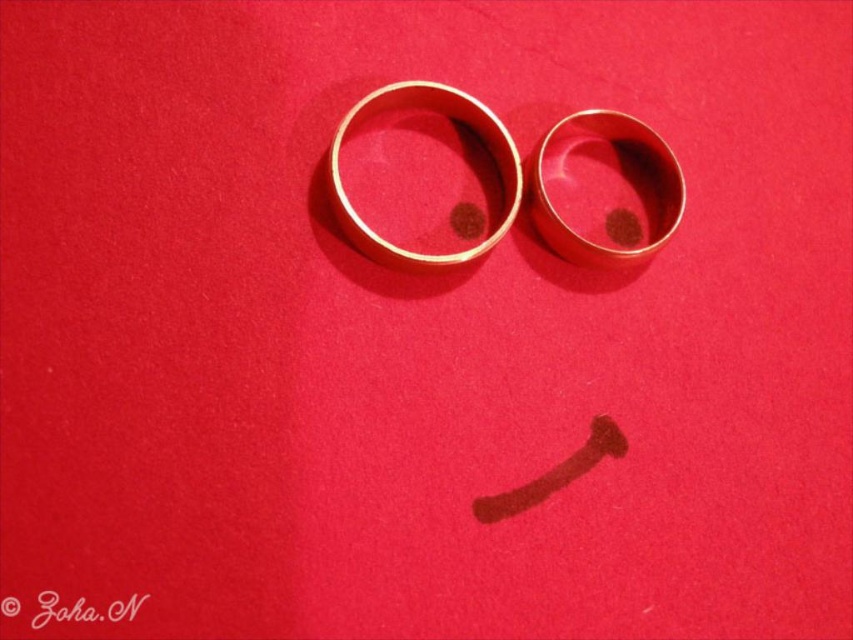
Question: Is gold polished ring at upper right to the left of gold polished ring at center from the viewer's perspective?

Choices:
 (A) no
 (B) yes

Answer: (A)

Question: Which point appears closest to the camera in this image?

Choices:
 (A) (352, 225)
 (B) (575, 234)

Answer: (A)

Question: Which point is closer to the camera?

Choices:
 (A) (398, 264)
 (B) (664, 173)

Answer: (A)

Question: Which point is closer to the camera?

Choices:
 (A) (496, 144)
 (B) (634, 156)

Answer: (A)

Question: In this image, where is gold polished ring at upper right located relative to gold polished ring at center?

Choices:
 (A) below
 (B) above

Answer: (A)

Question: Is gold polished ring at upper right positioned at the back of gold polished ring at center?

Choices:
 (A) no
 (B) yes

Answer: (B)